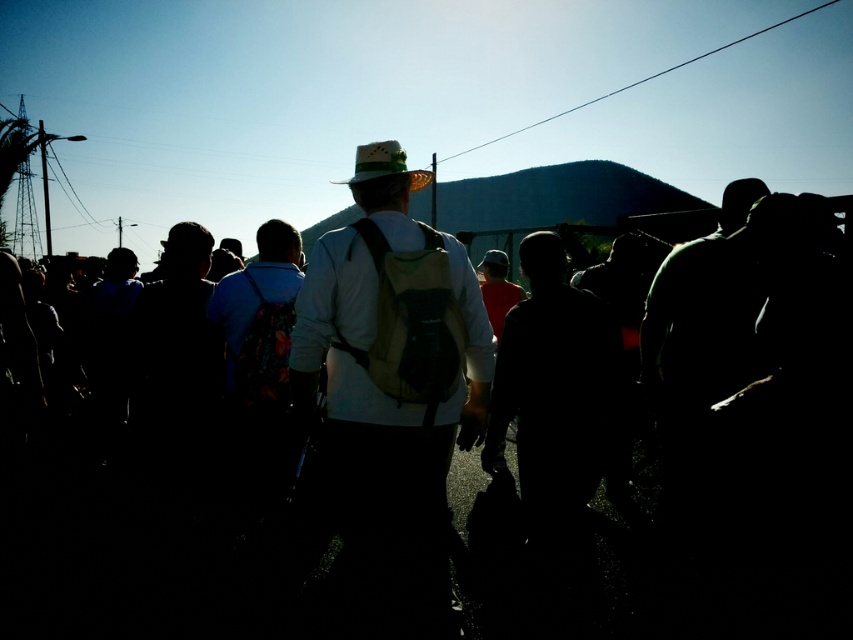
What do you see at coordinates (392, 378) in the screenshot?
I see `white matte shirt at center` at bounding box center [392, 378].

Does white matte shirt at center lie in front of green felt cowboy hat at center?

Yes, it is.

Is point (352, 264) less distant than point (392, 157)?

Yes.

Locate an element on the screen. The height and width of the screenshot is (640, 853). white matte shirt at center is located at coordinates (392, 378).

Between silhouette crowd at center and white matte shirt at center, which one is positioned lower?

silhouette crowd at center is below.

Between point (763, 500) and point (401, 337), which one is positioned behind?

The point (763, 500) is behind.

In order to click on silhouette crowd at center in this screenshot , I will do `click(183, 556)`.

Is point (814, 588) behind point (374, 147)?

That is True.

Does point (76, 536) lie in front of point (401, 148)?

That is False.

This screenshot has width=853, height=640. I want to click on silhouette crowd at center, so click(x=183, y=556).